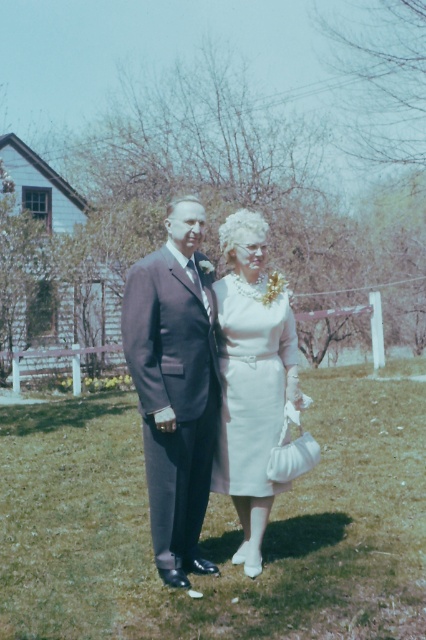
You are a photographer taking a portrait of the matte black suit at center and the white satin dress at center. The minimum focus distance for your camera is 8 inches. Can you focus on both subjects simultaneously without adjusting your camera settings?

The matte black suit at center and white satin dress at center are 9.03 inches apart, which exceeds the camera minimum focus distance of 8 inches. Therefore, the camera can focus on both subjects simultaneously without adjustment.

You are a photographer positioned at the origin point of the image. You need to capture a photo of the matte black suit at center. What are the coordinates where you should focus your camera?

The coordinates to focus on are at point [175,385].